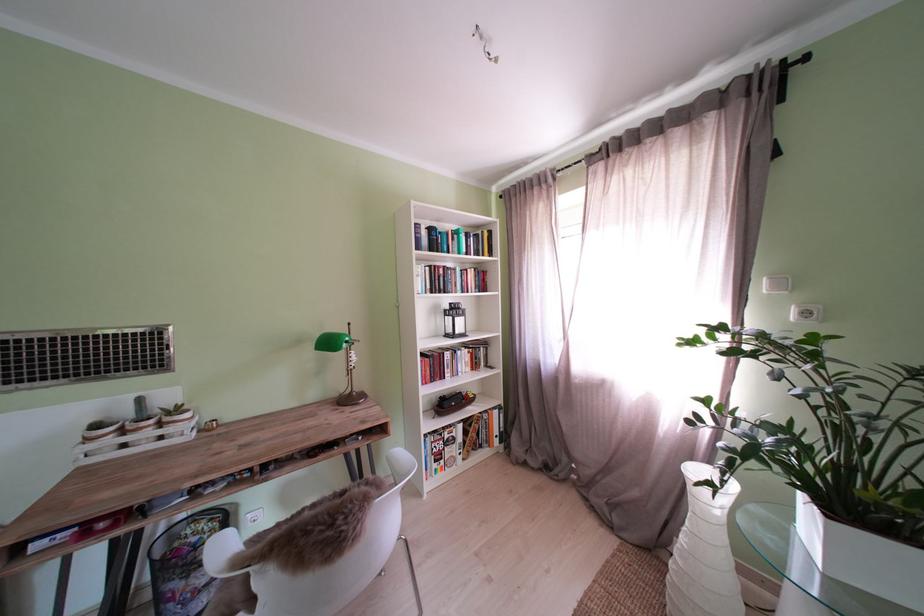
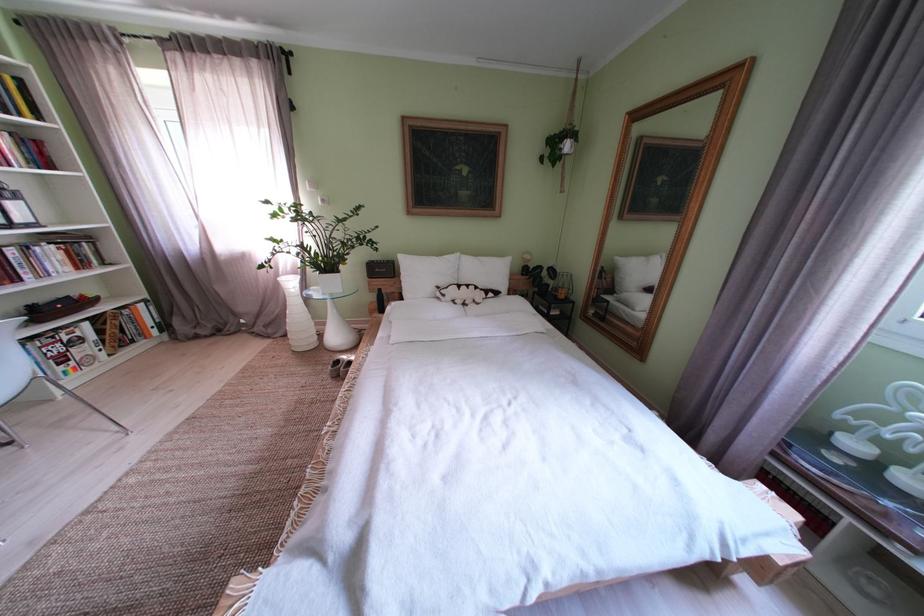
In the second image, find the point that corresponds to [481,278] in the first image.

(16, 145)